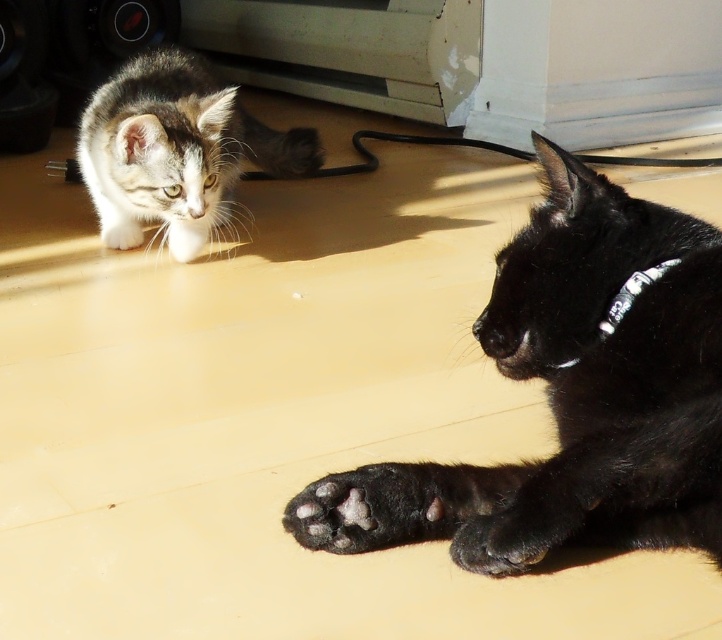
Does black soft paw at lower center have a lesser width compared to white fur paw at center?

No, black soft paw at lower center is not thinner than white fur paw at center.

Who is more forward, [408,497] or [187,259]?

Point [408,497] is more forward.

This screenshot has height=640, width=722. In order to click on black soft paw at lower center in this screenshot , I will do `click(365, 509)`.

Does tabby fur kitten at upper left come in front of white fur paw at center?

Yes, tabby fur kitten at upper left is closer to the viewer.

The width and height of the screenshot is (722, 640). Identify the location of tabby fur kitten at upper left. (175, 145).

What are the coordinates of `tabby fur kitten at upper left` in the screenshot? It's located at (175, 145).

Does black fur paw at lower right have a lesser width compared to tabby fur kitten at upper left?

Correct, black fur paw at lower right's width is less than tabby fur kitten at upper left's.

The width and height of the screenshot is (722, 640). I want to click on black fur paw at lower right, so click(570, 397).